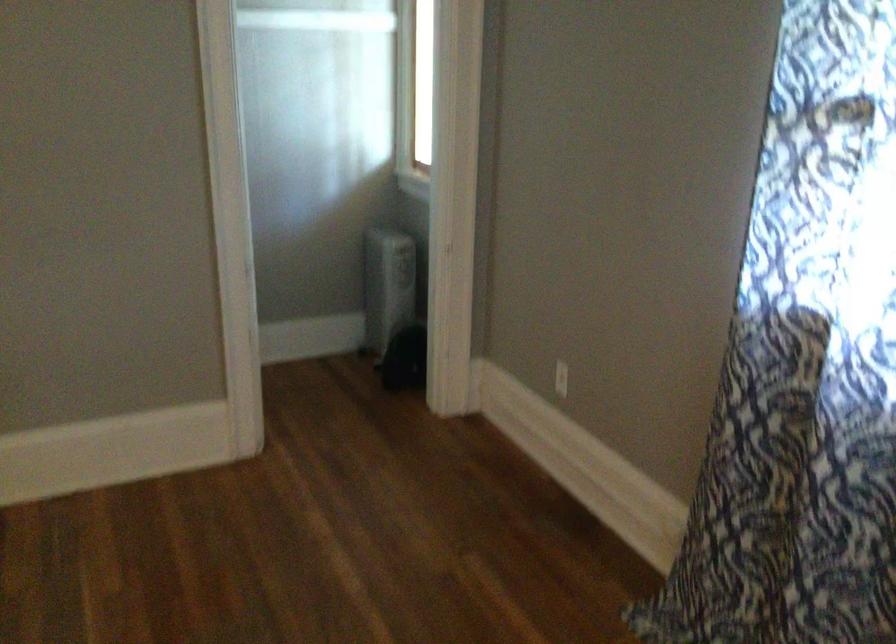
Identify the location of portable space heater. The width and height of the screenshot is (896, 644). (388, 285).